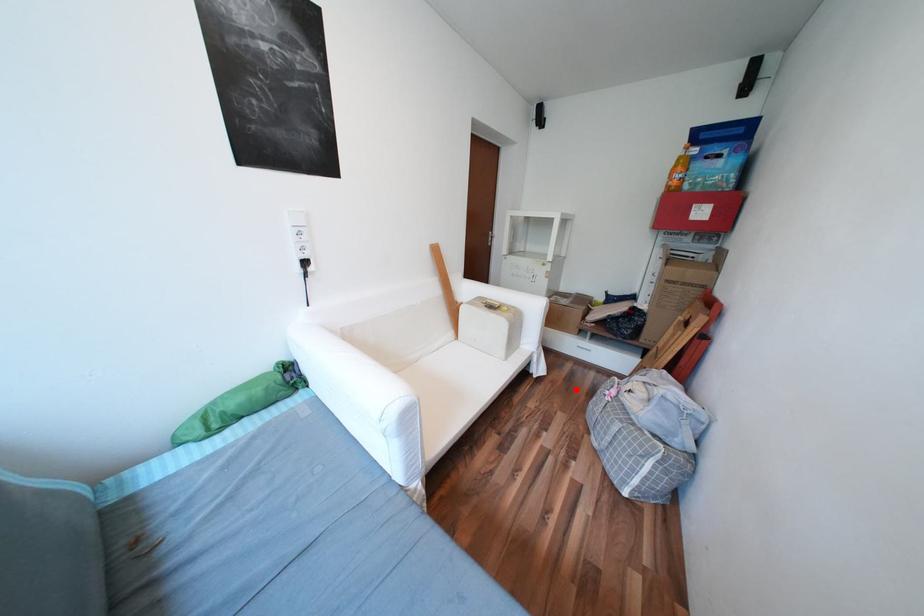
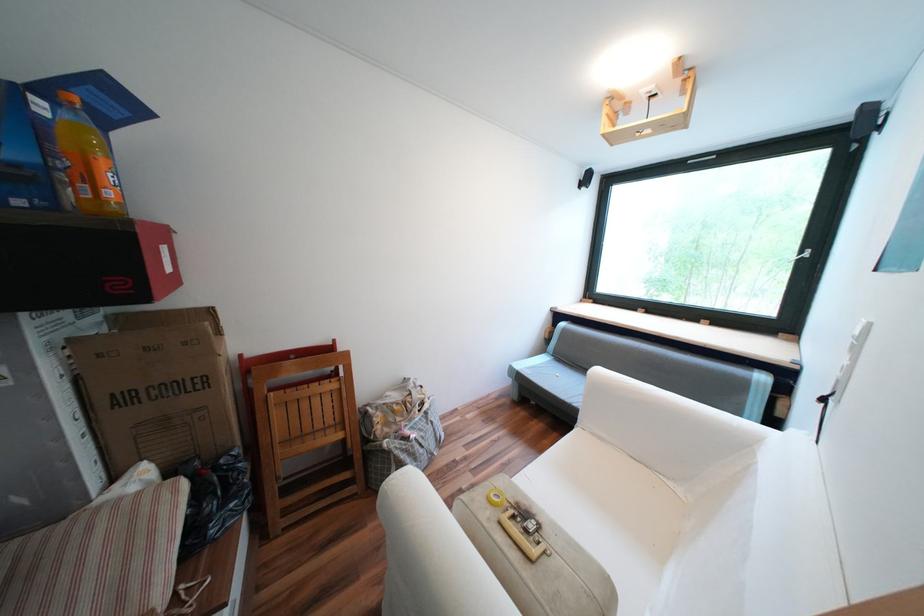
Find the pixel in the second image that matches the highlighted location in the first image.

(387, 548)